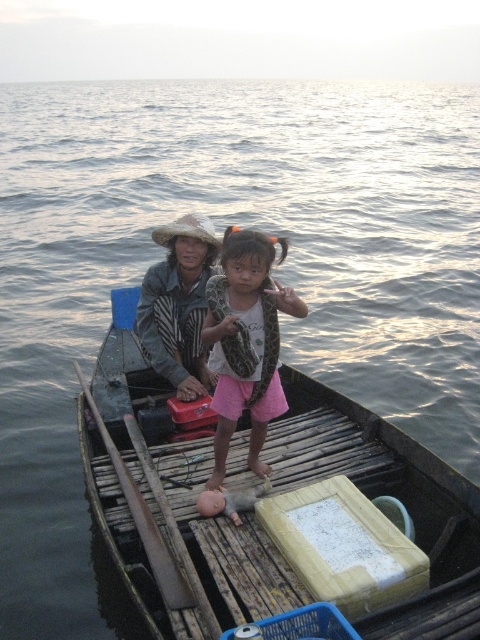
Does point (239, 273) come behind point (172, 586)?

Yes, point (239, 273) is farther from viewer.

Where is `pink fabric child at center`? Image resolution: width=480 pixels, height=640 pixels. pink fabric child at center is located at coordinates (245, 342).